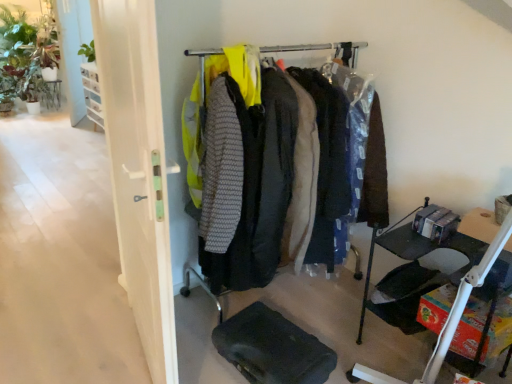
Question: From a real-world perspective, does black rubber footrest at lower center sit lower than matte black tray at lower right?

Choices:
 (A) no
 (B) yes

Answer: (B)

Question: Is black rubber footrest at lower center bigger than matte black tray at lower right?

Choices:
 (A) yes
 (B) no

Answer: (B)

Question: Is black rubber footrest at lower center closer to camera compared to matte black tray at lower right?

Choices:
 (A) yes
 (B) no

Answer: (B)

Question: Is black rubber footrest at lower center wider than matte black tray at lower right?

Choices:
 (A) yes
 (B) no

Answer: (B)

Question: Does black rubber footrest at lower center have a lesser height compared to matte black tray at lower right?

Choices:
 (A) no
 (B) yes

Answer: (B)

Question: Does black rubber footrest at lower center have a lesser width compared to matte black tray at lower right?

Choices:
 (A) yes
 (B) no

Answer: (A)

Question: Considering the relative positions of black fabric folding chair at lower right and white glossy door at left in the image provided, is black fabric folding chair at lower right to the left of white glossy door at left from the viewer's perspective?

Choices:
 (A) no
 (B) yes

Answer: (A)

Question: Does black fabric folding chair at lower right turn towards white glossy door at left?

Choices:
 (A) no
 (B) yes

Answer: (B)

Question: From a real-world perspective, is black fabric folding chair at lower right over white glossy door at left?

Choices:
 (A) yes
 (B) no

Answer: (B)

Question: From the image's perspective, would you say black fabric folding chair at lower right is positioned over white glossy door at left?

Choices:
 (A) no
 (B) yes

Answer: (A)

Question: Can we say black fabric folding chair at lower right lies outside white glossy door at left?

Choices:
 (A) no
 (B) yes

Answer: (B)

Question: Are black fabric folding chair at lower right and white glossy door at left far apart?

Choices:
 (A) no
 (B) yes

Answer: (B)

Question: Can you confirm if black rubber footrest at lower center is bigger than black fabric folding chair at lower right?

Choices:
 (A) yes
 (B) no

Answer: (A)